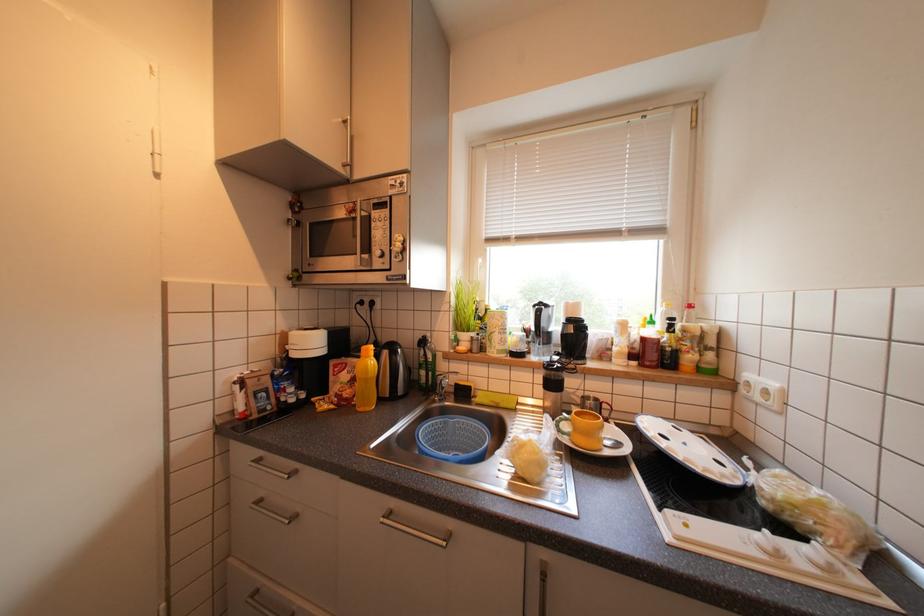
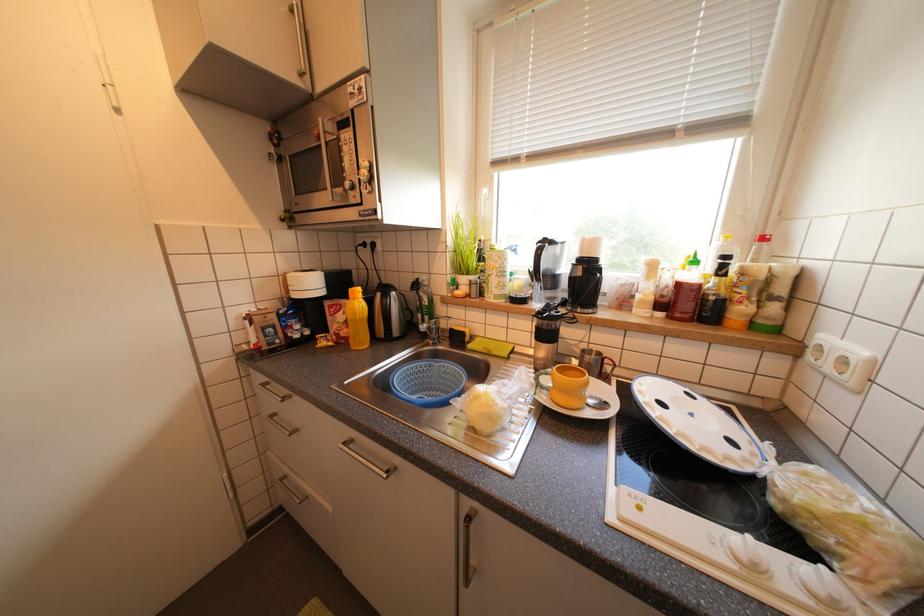
Question: Based on the continuous images, in which direction is the camera rotating? Reply with the corresponding letter.

Choices:
 (A) Left
 (B) Right
 (C) Up
 (D) Down

Answer: (D)